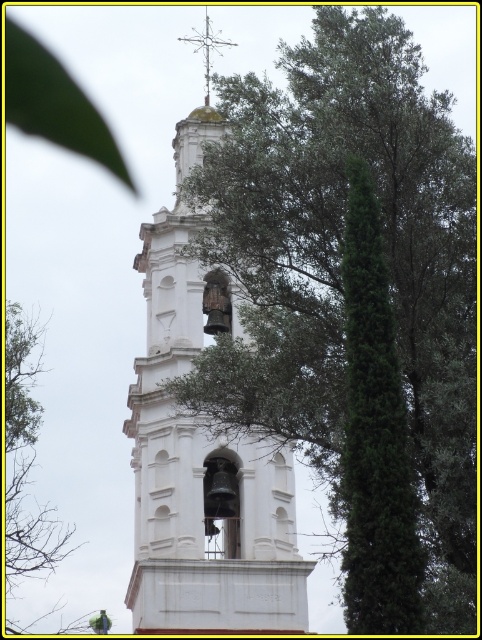
Which is above, green leafy tree at upper left or polished metal cross at upper center?

polished metal cross at upper center

Is point (45, 566) closer to viewer compared to point (187, 36)?

Yes, it is in front of point (187, 36).

Between point (12, 564) and point (205, 61), which one is positioned behind?

The point (12, 564) is behind.

Locate an element on the screen. green leafy tree at upper left is located at coordinates (26, 458).

At what (x,y) coordinates should I click in order to perform the action: click on green leafy tree at upper right. Please return your answer as a coordinate pair (x, y). The height and width of the screenshot is (640, 482). Looking at the image, I should click on (339, 269).

Can you confirm if green leafy tree at upper right is positioned above polished metal cross at upper center?

Incorrect, green leafy tree at upper right is not positioned above polished metal cross at upper center.

Measure the distance between green leafy tree at upper right and camera.

green leafy tree at upper right is 76.60 meters from camera.

Where is `green leafy tree at upper right`? This screenshot has width=482, height=640. green leafy tree at upper right is located at coordinates (339, 269).

Between white stone bell tower at center and polished metal cross at upper center, which one is positioned higher?

polished metal cross at upper center is higher up.

Is point (163, 248) positioned before point (204, 76)?

Yes, it is in front of point (204, 76).

Between point (275, 490) and point (217, 36), which one is positioned behind?

The point (217, 36) is more distant.

You are a GUI agent. You are given a task and a screenshot of the screen. Output one action in this format:
    pyautogui.click(x=<x>, y=<y>)
    Task: Click on the white stone bell tower at center
    
    Given the screenshot: What is the action you would take?
    pyautogui.click(x=201, y=456)